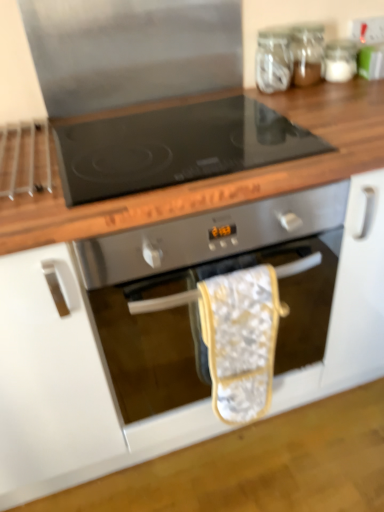
Question: From a real-world perspective, does transparent glass jar at upper right, marked as the 1th glass jar in a right-to-left arrangement, sit lower than stainless steel oven at center?

Choices:
 (A) yes
 (B) no

Answer: (B)

Question: Is transparent glass jar at upper right, the third glass jar in the left-to-right sequence, to the right of stainless steel oven at center from the viewer's perspective?

Choices:
 (A) no
 (B) yes

Answer: (B)

Question: Is transparent glass jar at upper right, marked as the 1th glass jar in a right-to-left arrangement, shorter than stainless steel oven at center?

Choices:
 (A) no
 (B) yes

Answer: (B)

Question: Is transparent glass jar at upper right, marked as the 1th glass jar in a right-to-left arrangement, surrounding stainless steel oven at center?

Choices:
 (A) yes
 (B) no

Answer: (B)

Question: From a real-world perspective, is transparent glass jar at upper right, the third glass jar in the left-to-right sequence, physically above stainless steel oven at center?

Choices:
 (A) no
 (B) yes

Answer: (B)

Question: From a real-world perspective, is stainless steel oven at center above or below transparent glass jar at upper right, placed as the 2th glass jar when sorted from left to right?

Choices:
 (A) below
 (B) above

Answer: (A)

Question: Considering the positions of stainless steel oven at center and transparent glass jar at upper right, placed as the 2th glass jar when sorted from left to right, in the image, is stainless steel oven at center wider or thinner than transparent glass jar at upper right, placed as the 2th glass jar when sorted from left to right,?

Choices:
 (A) wide
 (B) thin

Answer: (A)

Question: Is stainless steel oven at center inside or outside of transparent glass jar at upper right, placed as the 2th glass jar when sorted from left to right?

Choices:
 (A) inside
 (B) outside

Answer: (B)

Question: In terms of height, does stainless steel oven at center look taller or shorter compared to transparent glass jar at upper right, which appears as the second glass jar when viewed from the right?

Choices:
 (A) short
 (B) tall

Answer: (B)

Question: Is transparent glass jar at upper right, positioned as the 3th glass jar in right-to-left order, in front of or behind wooden at upper center in the image?

Choices:
 (A) front
 (B) behind

Answer: (B)

Question: Is point (286, 70) closer or farther from the camera than point (357, 93)?

Choices:
 (A) farther
 (B) closer

Answer: (A)

Question: Considering the positions of transparent glass jar at upper right, the first glass jar from the left, and wooden at upper center in the image, is transparent glass jar at upper right, the first glass jar from the left, taller or shorter than wooden at upper center?

Choices:
 (A) short
 (B) tall

Answer: (A)

Question: From the image's perspective, is transparent glass jar at upper right, positioned as the 3th glass jar in right-to-left order, above or below wooden at upper center?

Choices:
 (A) above
 (B) below

Answer: (A)

Question: Would you say stainless steel oven at center is to the left or to the right of wooden at upper center in the picture?

Choices:
 (A) left
 (B) right

Answer: (B)

Question: In terms of height, does stainless steel oven at center look taller or shorter compared to wooden at upper center?

Choices:
 (A) short
 (B) tall

Answer: (B)